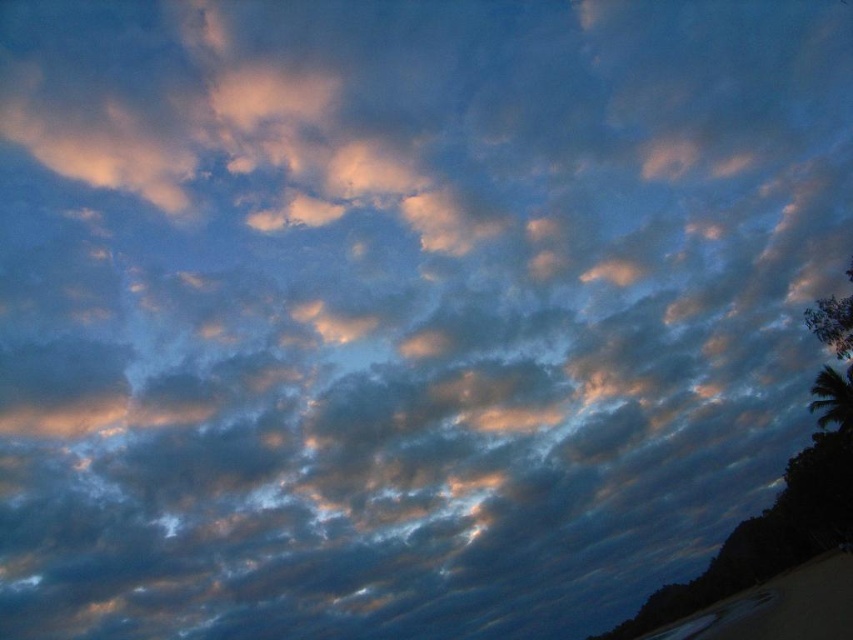
Question: Is sandy beach at lower right positioned in front of green leafy palm tree at lower right?

Choices:
 (A) no
 (B) yes

Answer: (B)

Question: Can you confirm if sandy beach at lower right is thinner than green leafy palm tree at lower right?

Choices:
 (A) yes
 (B) no

Answer: (B)

Question: Among these objects, which one is farthest from the camera?

Choices:
 (A) green leafy palm tree at lower right
 (B) sandy beach at lower right

Answer: (A)

Question: Among these points, which one is nearest to the camera?

Choices:
 (A) (820, 580)
 (B) (848, 378)

Answer: (A)

Question: Considering the relative positions of sandy beach at lower right and green leafy palm tree at lower right in the image provided, where is sandy beach at lower right located with respect to green leafy palm tree at lower right?

Choices:
 (A) below
 (B) above

Answer: (A)